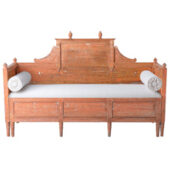
Find the location of `area above bench`. area above bench is located at coordinates (87, 21).